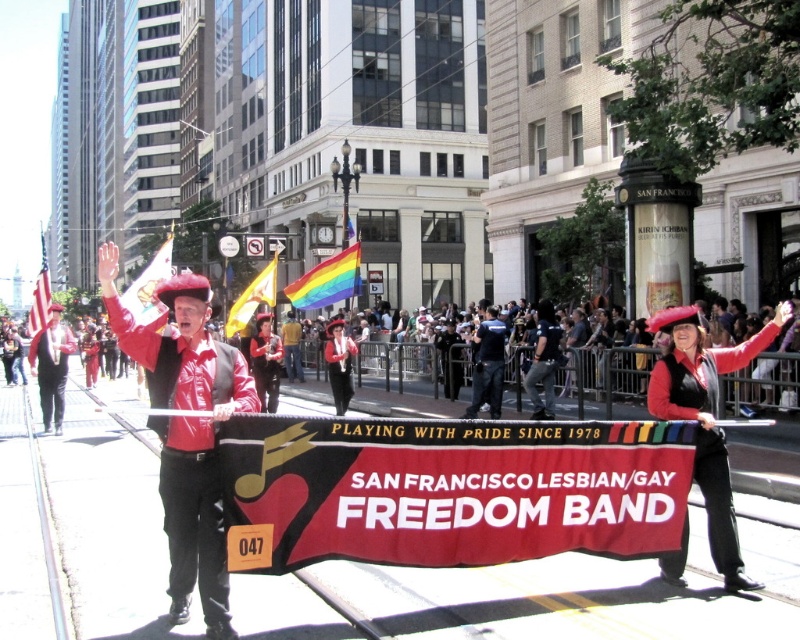
How much distance is there between shiny leather jacket at center and matte black jacket at center?

shiny leather jacket at center is 21.01 feet from matte black jacket at center.

Does shiny leather jacket at center appear on the left side of matte black jacket at center?

Correct, you'll find shiny leather jacket at center to the left of matte black jacket at center.

Which is in front, point (188, 509) or point (480, 342)?

Point (188, 509)

Find the location of a particular element. shiny leather jacket at center is located at coordinates (186, 432).

Looking at this image, who is lower down, red fabric banner at center or rainbow fabric flag at center?

Positioned lower is red fabric banner at center.

Is red fabric banner at center to the left of rainbow fabric flag at center from the viewer's perspective?

Incorrect, red fabric banner at center is not on the left side of rainbow fabric flag at center.

What do you see at coordinates (449, 490) in the screenshot?
I see `red fabric banner at center` at bounding box center [449, 490].

This screenshot has height=640, width=800. I want to click on red fabric banner at center, so click(449, 490).

Between shiny red hat at center and american flag at left, which one appears on the right side from the viewer's perspective?

Positioned to the right is shiny red hat at center.

Can you confirm if shiny red hat at center is positioned above american flag at left?

Actually, shiny red hat at center is below american flag at left.

Identify the location of shiny red hat at center. (340, 364).